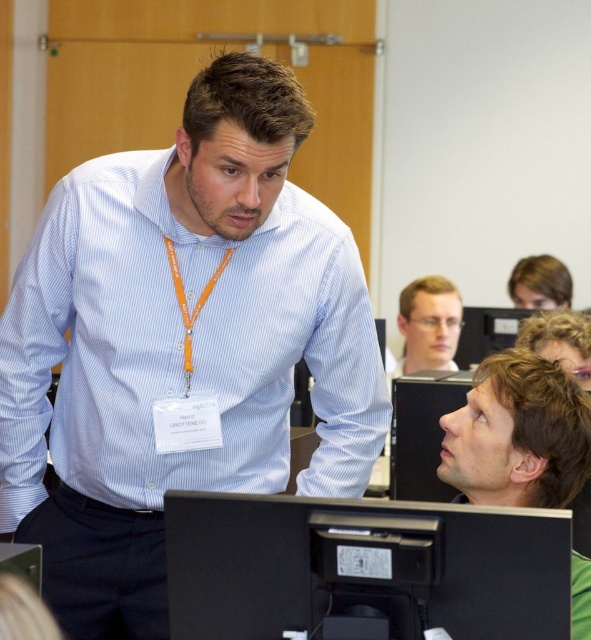
Is dark brown hair at lower right in front of clear plastic glasses at center?

Yes, it is in front of clear plastic glasses at center.

Between point (512, 371) and point (408, 305), which one is positioned behind?

The point (408, 305) is behind.

The image size is (591, 640). Identify the location of dark brown hair at lower right. (517, 435).

Can you confirm if blue striped shirt at center is positioned to the left of dark brown hair at lower right?

Indeed, blue striped shirt at center is positioned on the left side of dark brown hair at lower right.

Which is below, blue striped shirt at center or dark brown hair at lower right?

dark brown hair at lower right is lower down.

Measure the distance between point (271, 476) and camera.

Point (271, 476) is 1.80 meters away from camera.

I want to click on blue striped shirt at center, so click(181, 346).

Is black plastic monitor at lower center above clear plastic glasses at center?

Actually, black plastic monitor at lower center is below clear plastic glasses at center.

The height and width of the screenshot is (640, 591). What do you see at coordinates (421, 433) in the screenshot?
I see `black plastic monitor at lower center` at bounding box center [421, 433].

I want to click on black plastic monitor at lower center, so click(421, 433).